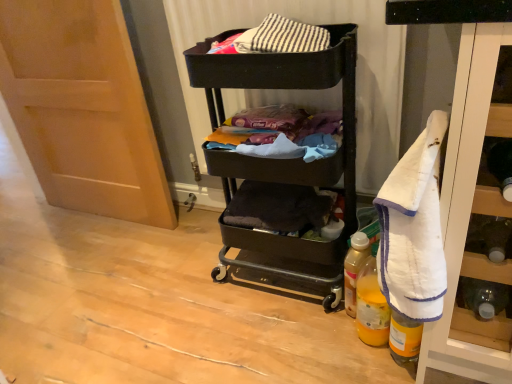
The height and width of the screenshot is (384, 512). In order to click on vacant region in front of black matte cart at center in this screenshot , I will do `click(282, 338)`.